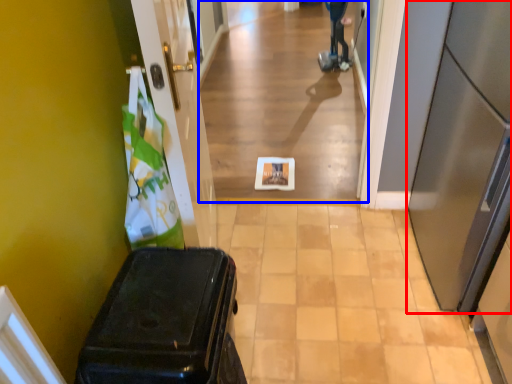
Question: Which point is closer to the camera, door (highlighted by a red box) or corridor (highlighted by a blue box)?

Choices:
 (A) door
 (B) corridor

Answer: (A)